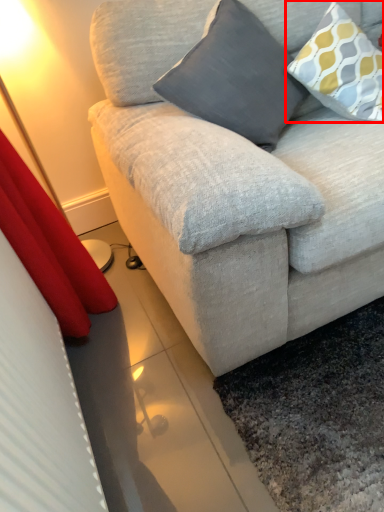
Question: From the image's perspective, where is pillow (annotated by the red box) located in relation to pillow in the image?

Choices:
 (A) below
 (B) above

Answer: (B)